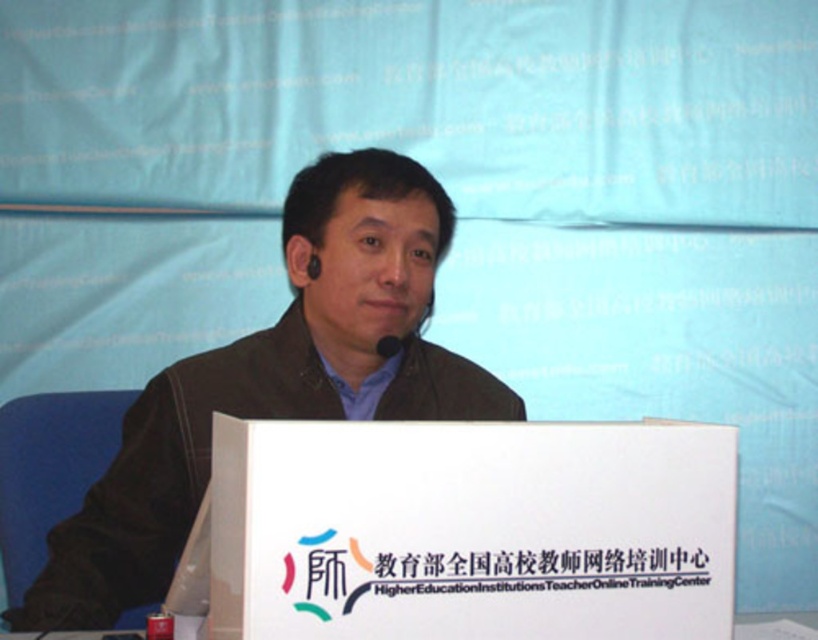
What is located at the coordinates point (502, 570) in the image?

The point (502, 570) indicates white paper at center.

You are organizing materials for an upcoming presentation. You have a white cardboard box at center and a white paper at center. How far apart are they?

The white cardboard box at center is 4.94 centimeters from white paper at center.

You are organizing a presentation and need to place a white cardboard box at center and a white paper at center on the podium. Since the podium has limited space, can you determine which item should be placed first to ensure both fit properly?

The white cardboard box at center is larger in size than the white paper at center, so you should place the white cardboard box at center first to ensure there is enough space for both items on the podium.